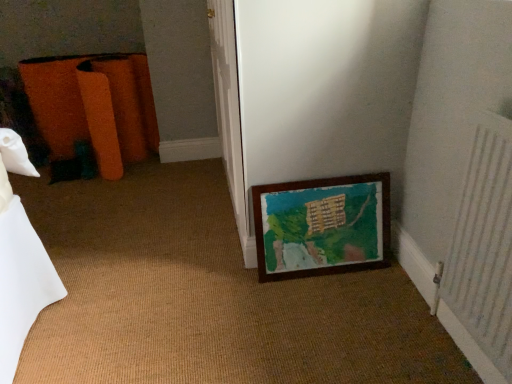
The image size is (512, 384). I want to click on vacant area that lies between wooden frame at lower right and white textured radiator at right, so click(x=366, y=311).